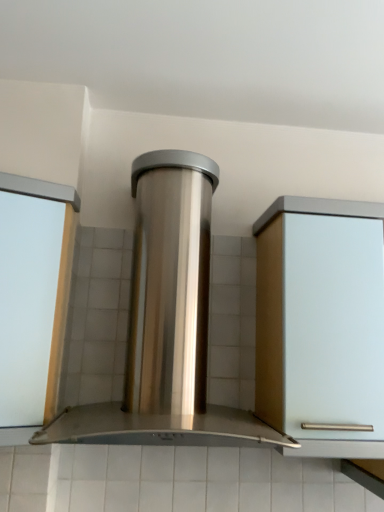
What do you see at coordinates (166, 323) in the screenshot?
I see `stainless steel range hood at center` at bounding box center [166, 323].

In order to click on stainless steel range hood at center in this screenshot , I will do `click(166, 323)`.

Find the location of a particular element. This screenshot has height=512, width=384. white glossy door at left is located at coordinates (59, 271).

Describe the element at coordinates (59, 271) in the screenshot. I see `white glossy door at left` at that location.

You are a GUI agent. You are given a task and a screenshot of the screen. Output one action in this format:
    pyautogui.click(x=<x>, y=<y>)
    Task: Click on the stainless steel range hood at center
    
    Given the screenshot: What is the action you would take?
    pyautogui.click(x=166, y=323)

Can you confirm if stainless steel range hood at center is positioned to the right of white glossy door at left?

Indeed, stainless steel range hood at center is positioned on the right side of white glossy door at left.

Is stainless steel range hood at center positioned behind white glossy door at left?

No, stainless steel range hood at center is closer to the camera.

Which point is more distant from viewer, (x=210, y=426) or (x=71, y=203)?

The point (x=71, y=203) is farther.

From the image's perspective, is stainless steel range hood at center beneath white glossy door at left?

Incorrect, from the image's perspective, stainless steel range hood at center is higher than white glossy door at left.

From a real-world perspective, who is located higher, stainless steel range hood at center or white glossy door at left?

stainless steel range hood at center.

Is stainless steel range hood at center wider or thinner than white glossy door at left?

In the image, stainless steel range hood at center appears to be wider than white glossy door at left.

Can you confirm if stainless steel range hood at center is shorter than white glossy door at left?

Incorrect, the height of stainless steel range hood at center does not fall short of that of white glossy door at left.

Based on their sizes in the image, would you say stainless steel range hood at center is bigger or smaller than white glossy door at left?

Clearly, stainless steel range hood at center is larger in size than white glossy door at left.

Do you think stainless steel range hood at center is within white glossy door at left, or outside of it?

The correct answer is: outside.

Is stainless steel range hood at center positioned far away from white glossy door at left?

No, stainless steel range hood at center is not far from white glossy door at left.

Is stainless steel range hood at center positioned with its back to white glossy door at left?

No, stainless steel range hood at center is not facing the opposite direction of white glossy door at left.

How different are the orientations of stainless steel range hood at center and white glossy door at left in degrees?

stainless steel range hood at center and white glossy door at left are facing 0.646 degrees away from each other.

The width and height of the screenshot is (384, 512). Find the location of `home appliance located in front of the white glossy door at left`. home appliance located in front of the white glossy door at left is located at coordinates (166, 323).

Consider the image. Is white glossy door at left to the left or to the right of stainless steel range hood at center in the image?

white glossy door at left is to the left of stainless steel range hood at center.

Based on the photo, which object is further away from the camera, white glossy door at left or stainless steel range hood at center?

white glossy door at left is behind.

Does point (50, 415) come behind point (168, 202)?

No, it is not.

From the image's perspective, which object appears higher, white glossy door at left or stainless steel range hood at center?

stainless steel range hood at center is shown above in the image.

From a real-world perspective, is white glossy door at left positioned above or below stainless steel range hood at center?

white glossy door at left is situated lower than stainless steel range hood at center in the real world.

Considering the relative sizes of white glossy door at left and stainless steel range hood at center in the image provided, is white glossy door at left wider than stainless steel range hood at center?

No, white glossy door at left is not wider than stainless steel range hood at center.

Considering the sizes of objects white glossy door at left and stainless steel range hood at center in the image provided, who is shorter, white glossy door at left or stainless steel range hood at center?

white glossy door at left is shorter.

Looking at the image, does white glossy door at left seem bigger or smaller compared to stainless steel range hood at center?

white glossy door at left is smaller than stainless steel range hood at center.

Which is correct: white glossy door at left is inside stainless steel range hood at center, or outside of it?

white glossy door at left lies outside stainless steel range hood at center.

Are white glossy door at left and stainless steel range hood at center beside each other?

No, white glossy door at left is not in contact with stainless steel range hood at center.

Is white glossy door at left aimed at stainless steel range hood at center?

No, white glossy door at left is not turned towards stainless steel range hood at center.

How different are the orientations of white glossy door at left and stainless steel range hood at center in degrees?

Result: 0.646 degrees.

Find the location of a particular element. home appliance to the right of white glossy door at left is located at coordinates (166, 323).

Image resolution: width=384 pixels, height=512 pixels. I want to click on home appliance that appears on the right of white glossy door at left, so click(166, 323).

Locate an element on the screen. Image resolution: width=384 pixels, height=512 pixels. window frame located on the left of stainless steel range hood at center is located at coordinates (59, 271).